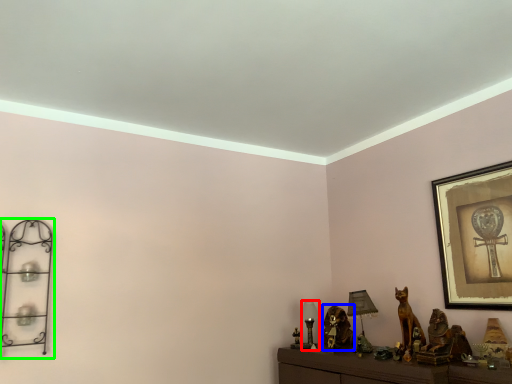
Question: Which object is positioned closest to table lamp (highlighted by a red box)? Select from animal (highlighted by a blue box) and shelf (highlighted by a green box).

Choices:
 (A) animal
 (B) shelf

Answer: (A)